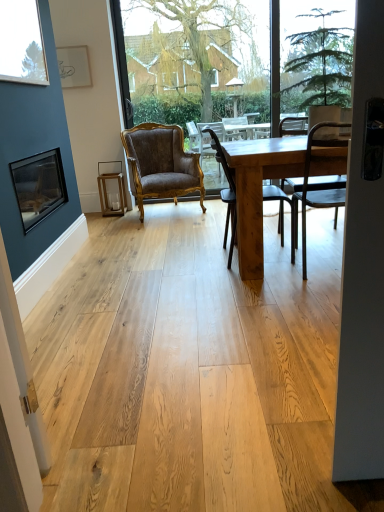
You are a GUI agent. You are given a task and a screenshot of the screen. Output one action in this format:
    pyautogui.click(x=<x>, y=<y>)
    Task: Click on the vacant space situated on the left part of natural wood table at center
    The height and width of the screenshot is (512, 384).
    Given the screenshot: What is the action you would take?
    pyautogui.click(x=163, y=270)